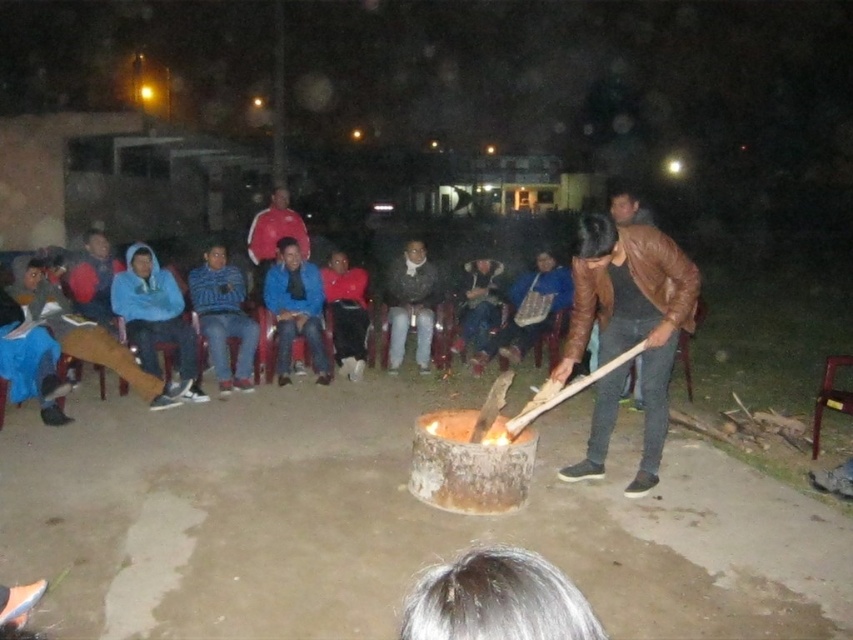
You are a photographer standing at the camera position. You want to take a closeup photo of the brown leather jacket at center. Can you step forward to get closer without moving the person wearing it?

The brown leather jacket at center is 4.18 meters away from the camera. Since 4.18 meters is approximately 13.7 feet, stepping forward would require moving about 1.5 meters closer to reduce the distance, which is feasible unless there are obstacles. Therefore, yes, you can step forward to get closer to the brown leather jacket at center for a closeup photo.